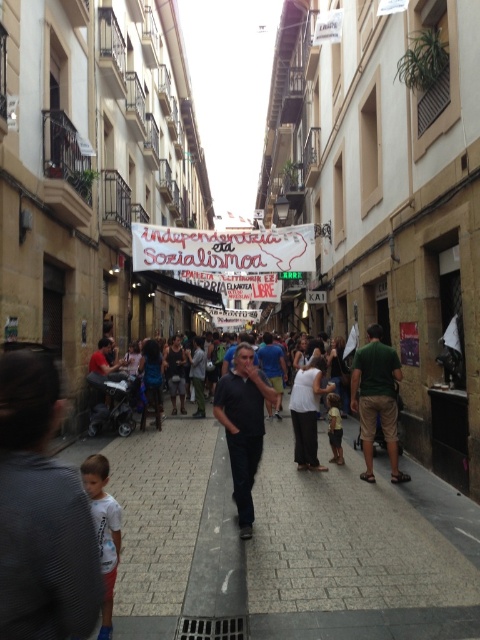
Question: Is white paper banner at center positioned in front of white cotton shirt at lower left?

Choices:
 (A) no
 (B) yes

Answer: (A)

Question: Does dark blue jeans at center have a larger size compared to white cotton shirt at lower left?

Choices:
 (A) no
 (B) yes

Answer: (B)

Question: Estimate the real-world distances between objects in this image. Which object is closer to the white cotton shirt at lower left?

Choices:
 (A) green fabric shirt at right
 (B) light brown leather pants at center
 (C) white cotton shirt at center
 (D) dark blue shirt at center

Answer: (D)

Question: Considering the real-world distances, which object is farthest from the white paper banner at center?

Choices:
 (A) dark blue shirt at center
 (B) white cotton shirt at center
 (C) light brown leather pants at center

Answer: (A)

Question: Which is nearer to the dark blue shirt at center?

Choices:
 (A) white cotton shirt at lower left
 (B) light brown leather pants at center

Answer: (A)

Question: Where is white paper banner at center located in relation to white cotton shirt at lower left in the image?

Choices:
 (A) below
 (B) above

Answer: (B)